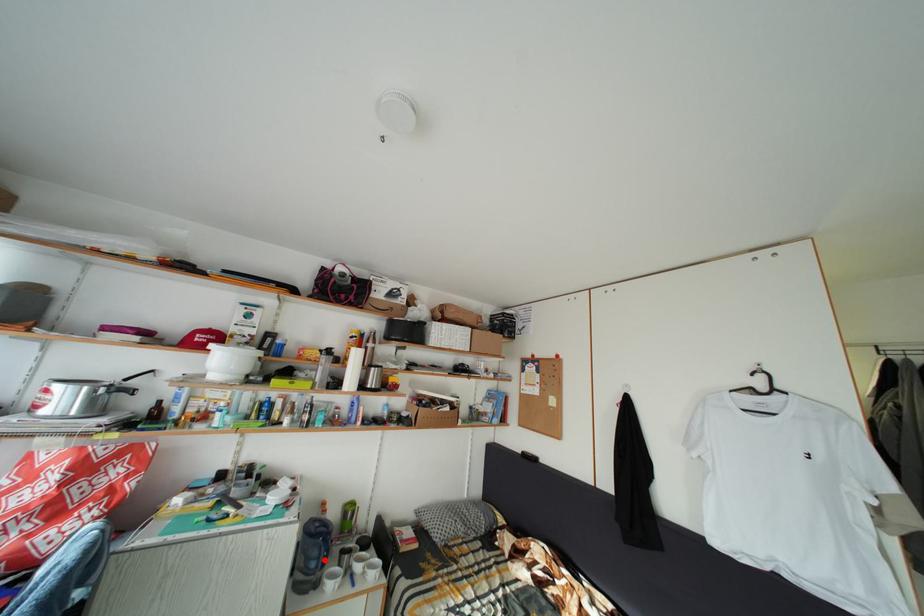
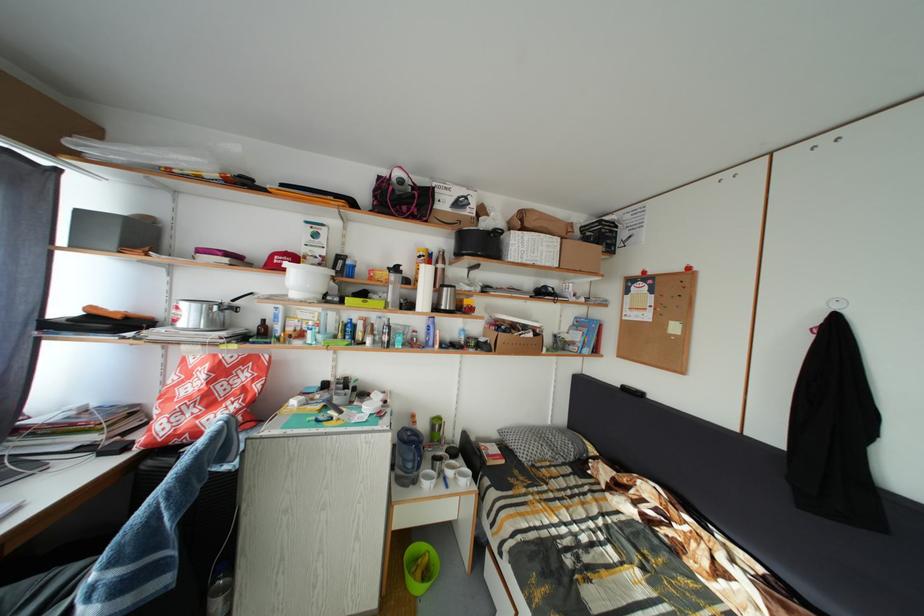
The point at the highlighted location is marked in the first image. Where is the corresponding point in the second image?

(419, 464)